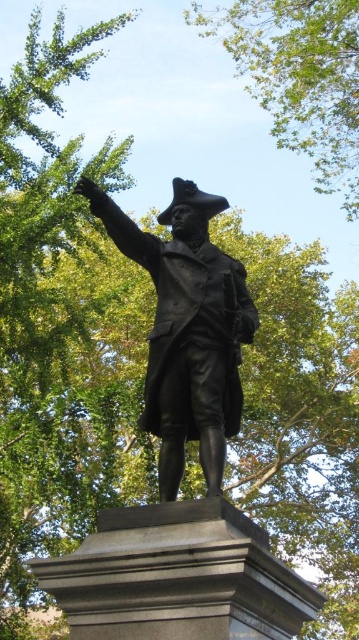
Between bronze statue at center and green leafy tree at upper center, which one has more height?

Standing taller between the two is green leafy tree at upper center.

Which is more to the right, bronze statue at center or green leafy tree at upper center?

green leafy tree at upper center is more to the right.

Identify the location of bronze statue at center. Image resolution: width=359 pixels, height=640 pixels. (187, 332).